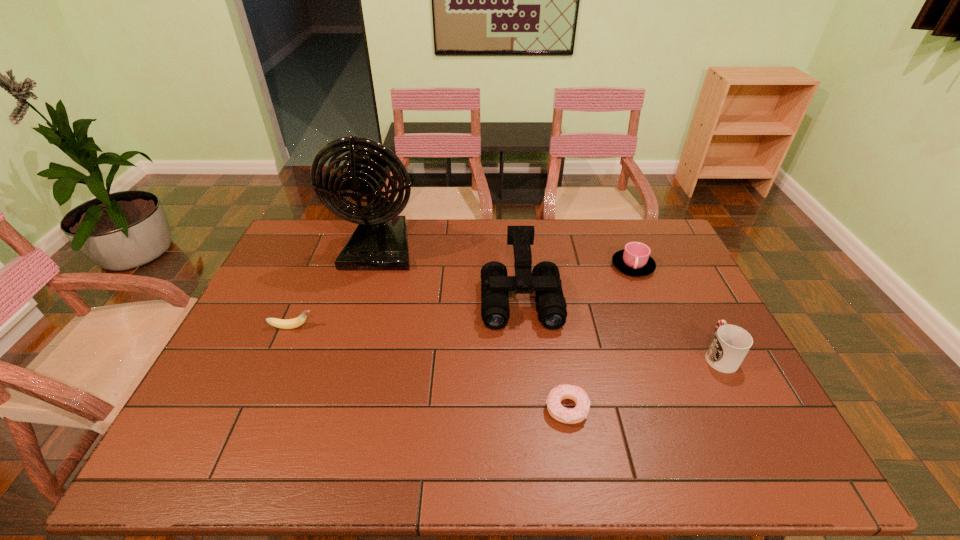
Image resolution: width=960 pixels, height=540 pixels. I want to click on object that is at the far right corner, so click(635, 259).

Locate an element on the screen. The width and height of the screenshot is (960, 540). vacant region at the far edge is located at coordinates (613, 253).

This screenshot has width=960, height=540. In the image, there is a desktop. Find the location of `vacant space at the left edge`. vacant space at the left edge is located at coordinates (233, 359).

Where is `blank space at the right edge of the desktop`? The width and height of the screenshot is (960, 540). blank space at the right edge of the desktop is located at coordinates (715, 413).

This screenshot has height=540, width=960. In the image, there is a desktop. In order to click on vacant space at the far right corner in this screenshot , I will do `click(660, 227)`.

This screenshot has width=960, height=540. What are the coordinates of `unoccupied position between the nearest object and the fan` in the screenshot? It's located at (473, 328).

This screenshot has height=540, width=960. In order to click on vacant space that's between the third tallest object and the nearest object in this screenshot , I will do `click(643, 382)`.

Find the location of a particular element. The height and width of the screenshot is (540, 960). free space that is in between the binoculars and the taller cup is located at coordinates (620, 327).

At what (x,y) coordinates should I click in order to perform the action: click on vacant space in between the second tallest object and the tallest object. Please return your answer as a coordinate pair (x, y). The width and height of the screenshot is (960, 540). Looking at the image, I should click on (450, 273).

At what (x,y) coordinates should I click in order to perform the action: click on free space between the left cup and the taller cup. Please return your answer as a coordinate pair (x, y). Looking at the image, I should click on (676, 310).